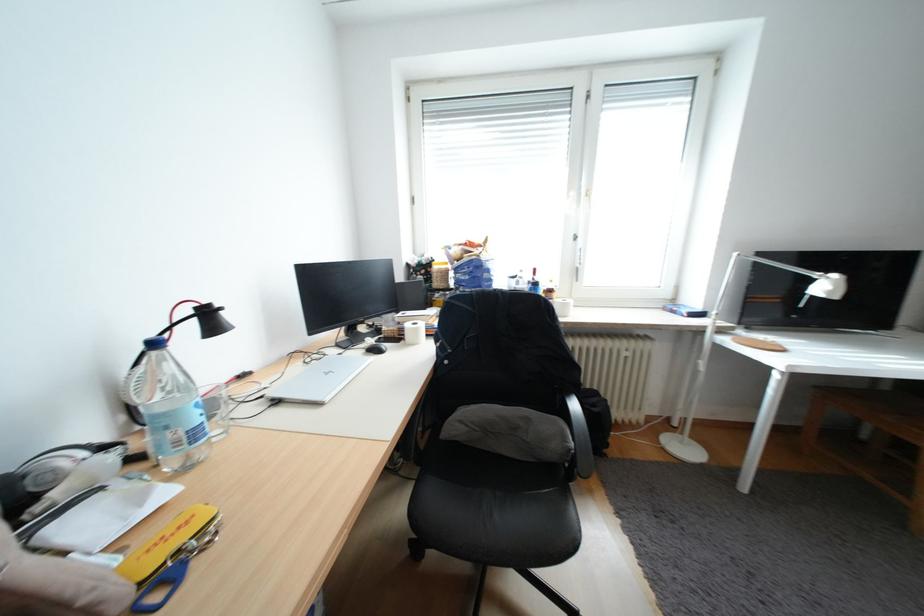
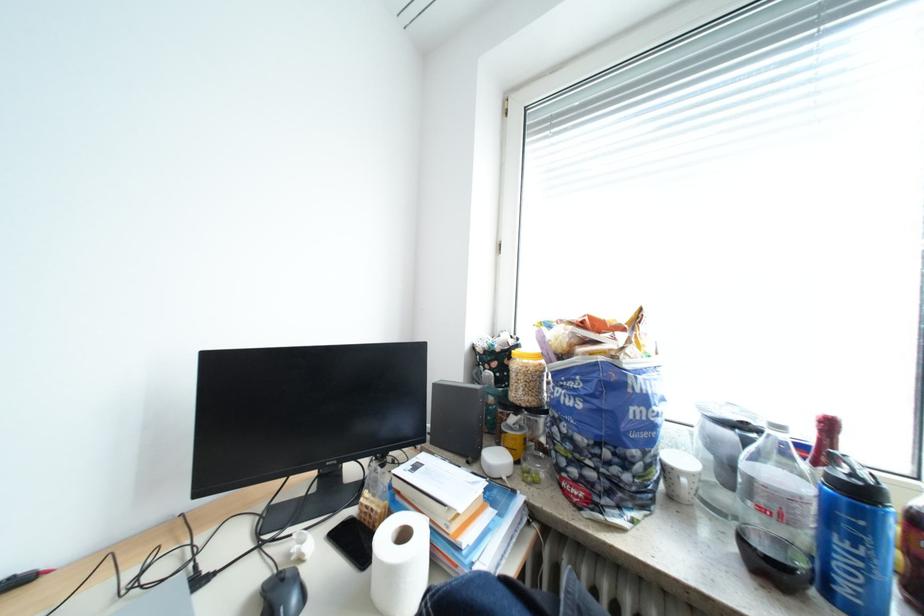
Locate, in the second image, the point that corresponds to the point at 430,330 in the first image.

(404, 573)